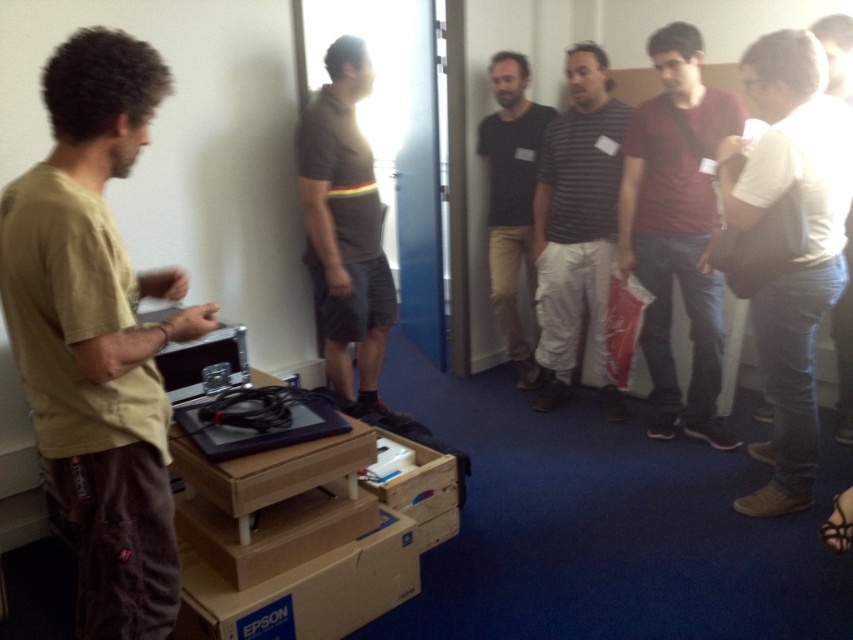
Can you confirm if white cotton shirt at right is thinner than black cotton shirt at center?

In fact, white cotton shirt at right might be wider than black cotton shirt at center.

Between point (827, 179) and point (495, 224), which one is positioned in front?

Point (827, 179) is in front.

Is point (827, 147) closer to camera compared to point (531, 161)?

Yes, point (827, 147) is in front of point (531, 161).

The height and width of the screenshot is (640, 853). I want to click on white cotton shirt at right, so click(x=796, y=257).

You are a GUI agent. You are given a task and a screenshot of the screen. Output one action in this format:
    pyautogui.click(x=<x>, y=<y>)
    Task: Click on the khaki cotton t-shirt at left
    This screenshot has height=640, width=853.
    Given the screenshot: What is the action you would take?
    pyautogui.click(x=97, y=333)

Consider the image. Is khaki cotton t-shirt at left bigger than dark gray t-shirt at center?

Incorrect, khaki cotton t-shirt at left is not larger than dark gray t-shirt at center.

The height and width of the screenshot is (640, 853). What do you see at coordinates (97, 333) in the screenshot?
I see `khaki cotton t-shirt at left` at bounding box center [97, 333].

The width and height of the screenshot is (853, 640). Identify the location of khaki cotton t-shirt at left. (97, 333).

Does khaki cotton t-shirt at left have a greater width compared to white cotton shirt at right?

No, khaki cotton t-shirt at left is not wider than white cotton shirt at right.

Does point (167, 600) lie behind point (750, 513)?

No.

What are the coordinates of `khaki cotton t-shirt at left` in the screenshot? It's located at (97, 333).

The image size is (853, 640). In order to click on khaki cotton t-shirt at left in this screenshot , I will do `click(97, 333)`.